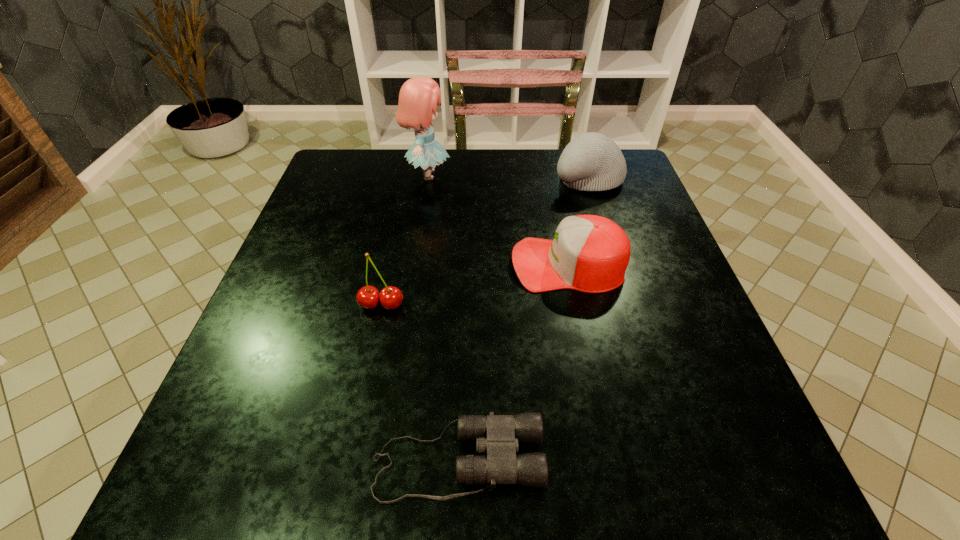
Image resolution: width=960 pixels, height=540 pixels. Find the location of `vacant space that satisfies the following two spatial constraints: 1. on the front-facing side of the beanie; 2. on the right side of the doll`. vacant space that satisfies the following two spatial constraints: 1. on the front-facing side of the beanie; 2. on the right side of the doll is located at coordinates (427, 178).

Find the location of a particular element. Image resolution: width=960 pixels, height=540 pixels. vacant space that satisfies the following two spatial constraints: 1. on the front-facing side of the third farthest object; 2. with the stems of the second nearest object pointing upwards is located at coordinates (576, 305).

This screenshot has width=960, height=540. In order to click on free space that satisfies the following two spatial constraints: 1. on the front-facing side of the doll; 2. on the left side of the beanie in this screenshot , I will do `click(427, 178)`.